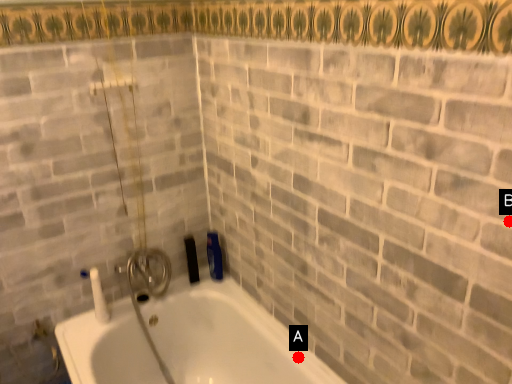
Question: Two points are circled on the image, labeled by A and B beside each circle. Which point is closer to the camera?

Choices:
 (A) A is closer
 (B) B is closer

Answer: (B)